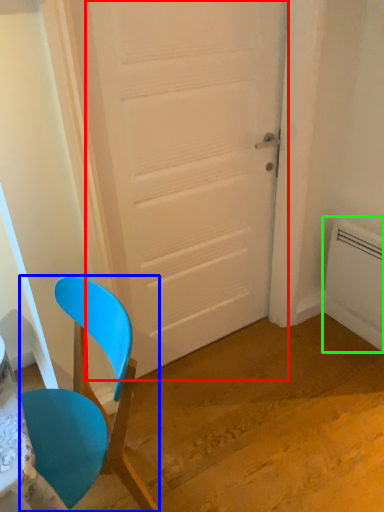
Question: Based on their relative distances, which object is nearer to door (highlighted by a red box)? Choose from chair (highlighted by a blue box) and radiator (highlighted by a green box).

Choices:
 (A) chair
 (B) radiator

Answer: (A)